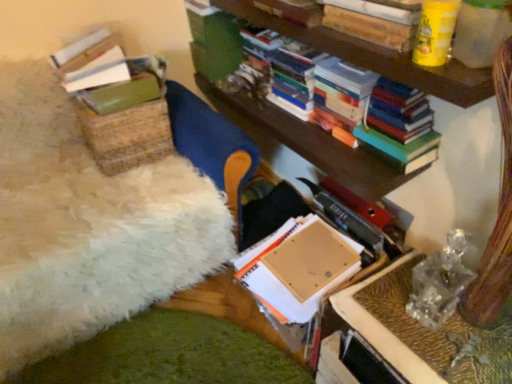
The height and width of the screenshot is (384, 512). In order to click on cardboard box at center, arranged as the second book when viewed from the top in this screenshot , I will do `click(320, 217)`.

Locate an element on the screen. This screenshot has width=512, height=384. hardcover book at upper center, positioned as the 2th book in bottom-to-top order is located at coordinates coord(293,11).

Locate an element on the screen. This screenshot has height=384, width=512. cardboard box at center, arranged as the second book when viewed from the top is located at coordinates tap(320, 217).

Is translucent plastic table at lower right not close to cardboard box at center, arranged as the second book when viewed from the top?

They are positioned close to each other.

Is point (405, 350) closer to camera compared to point (366, 260)?

Yes, point (405, 350) is closer to viewer.

From a real-world perspective, which is physically above, cardboard box at center, arranged as the second book when viewed from the top, or hardcover book at upper center, positioned as the 2th book in bottom-to-top order?

From a 3D spatial view, hardcover book at upper center, positioned as the 2th book in bottom-to-top order, is above.

Image resolution: width=512 pixels, height=384 pixels. In order to click on book above the cardboard box at center, the 1th book from the bottom (from a real-world perspective) in this screenshot , I will do `click(293, 11)`.

From the image's perspective, between cardboard box at center, arranged as the second book when viewed from the top, and hardcover book at upper center, marked as the first book in a top-to-bottom arrangement, who is located below?

From the image's view, cardboard box at center, arranged as the second book when viewed from the top, is below.

Is translucent plastic table at lower right further to camera compared to hardcover books at upper right?

No, it is in front of hardcover books at upper right.

From their relative heights in the image, would you say translucent plastic table at lower right is taller or shorter than hardcover books at upper right?

translucent plastic table at lower right is shorter than hardcover books at upper right.

From the image's perspective, is translucent plastic table at lower right above or below hardcover books at upper right?

Based on their image positions, translucent plastic table at lower right is located beneath hardcover books at upper right.

From a real-world perspective, which is physically above, translucent plastic table at lower right or hardcover books at upper right?

hardcover books at upper right.

The height and width of the screenshot is (384, 512). I want to click on book that is under the hardcover books at upper right (from a real-world perspective), so click(320, 217).

Consider the image. Is hardcover books at upper right inside the boundaries of cardboard box at center, arranged as the second book when viewed from the top, or outside?

hardcover books at upper right is located beyond the bounds of cardboard box at center, arranged as the second book when viewed from the top.

Is hardcover books at upper right directly adjacent to cardboard box at center, the 1th book from the bottom?

hardcover books at upper right and cardboard box at center, the 1th book from the bottom, are not in contact.

Which is behind, point (362, 133) or point (368, 233)?

Point (368, 233)

Considering the relative positions of hardcover books at upper right and hardcover book at upper center, positioned as the 2th book in bottom-to-top order, in the image provided, is hardcover books at upper right to the left of hardcover book at upper center, positioned as the 2th book in bottom-to-top order, from the viewer's perspective?

In fact, hardcover books at upper right is to the right of hardcover book at upper center, positioned as the 2th book in bottom-to-top order.

Between hardcover books at upper right and hardcover book at upper center, marked as the first book in a top-to-bottom arrangement, which one has smaller width?

With smaller width is hardcover books at upper right.

Is hardcover books at upper right facing away from hardcover book at upper center, positioned as the 2th book in bottom-to-top order?

No, hardcover book at upper center, positioned as the 2th book in bottom-to-top order, is not at the back of hardcover books at upper right.

Looking at this image, from a real-world perspective, is hardcover books at upper right above or below hardcover book at upper center, marked as the first book in a top-to-bottom arrangement?

hardcover books at upper right is situated lower than hardcover book at upper center, marked as the first book in a top-to-bottom arrangement, in the real world.

From the picture: Between hardcover books at upper right and translucent plastic table at lower right, which one has more height?

Standing taller between the two is hardcover books at upper right.

Are hardcover books at upper right and translucent plastic table at lower right making contact?

No, hardcover books at upper right is not beside translucent plastic table at lower right.

From a real-world perspective, is hardcover books at upper right above or below translucent plastic table at lower right?

hardcover books at upper right is above translucent plastic table at lower right.

In the image, there is a hardcover book at upper center, positioned as the 2th book in bottom-to-top order. At what (x,y) coordinates should I click in order to perform the action: click on book below it (from the image's perspective). Please return your answer as a coordinate pair (x, y). The height and width of the screenshot is (384, 512). Looking at the image, I should click on (320, 217).

From a real-world perspective, does hardcover book at upper center, marked as the first book in a top-to-bottom arrangement, stand above cardboard box at center, the 1th book from the bottom?

Correct, in the physical world, hardcover book at upper center, marked as the first book in a top-to-bottom arrangement, is higher than cardboard box at center, the 1th book from the bottom.

Is hardcover book at upper center, marked as the first book in a top-to-bottom arrangement, located outside cardboard box at center, the 1th book from the bottom?

That's correct, hardcover book at upper center, marked as the first book in a top-to-bottom arrangement, is outside of cardboard box at center, the 1th book from the bottom.

Is hardcover book at upper center, marked as the first book in a top-to-bottom arrangement, shorter than cardboard box at center, arranged as the second book when viewed from the top?

Indeed, hardcover book at upper center, marked as the first book in a top-to-bottom arrangement, has a lesser height compared to cardboard box at center, arranged as the second book when viewed from the top.

I want to click on table that is below the cardboard box at center, the 1th book from the bottom (from the image's perspective), so click(x=407, y=339).

Image resolution: width=512 pixels, height=384 pixels. I want to click on book above the cardboard box at center, arranged as the second book when viewed from the top (from the image's perspective), so click(293, 11).

In the scene shown: Looking at the image, which one is located further to translucent plastic table at lower right, hardcover book at upper center, positioned as the 2th book in bottom-to-top order, or hardcover books at upper right?

The object further to translucent plastic table at lower right is hardcover book at upper center, positioned as the 2th book in bottom-to-top order.

Considering their positions, is hardcover books at upper right positioned further to hardcover book at upper center, marked as the first book in a top-to-bottom arrangement, than translucent plastic table at lower right?

translucent plastic table at lower right is further to hardcover book at upper center, marked as the first book in a top-to-bottom arrangement.

When comparing their distances from hardcover books at upper right, does hardcover book at upper center, positioned as the 2th book in bottom-to-top order, or translucent plastic table at lower right seem closer?

hardcover book at upper center, positioned as the 2th book in bottom-to-top order.

From the image, which object appears to be farther from hardcover book at upper center, positioned as the 2th book in bottom-to-top order, cardboard box at center, arranged as the second book when viewed from the top, or hardcover books at upper right?

Among the two, cardboard box at center, arranged as the second book when viewed from the top, is located further to hardcover book at upper center, positioned as the 2th book in bottom-to-top order.

From the image, which object appears to be farther from hardcover book at upper center, marked as the first book in a top-to-bottom arrangement, translucent plastic table at lower right or hardcover books at upper right?

translucent plastic table at lower right is positioned further to the anchor hardcover book at upper center, marked as the first book in a top-to-bottom arrangement.

Estimate the real-world distances between objects in this image. Which object is further from cardboard box at center, arranged as the second book when viewed from the top, hardcover book at upper center, marked as the first book in a top-to-bottom arrangement, or hardcover books at upper right?

Based on the image, hardcover book at upper center, marked as the first book in a top-to-bottom arrangement, appears to be further to cardboard box at center, arranged as the second book when viewed from the top.

Which object lies further to the anchor point hardcover books at upper right, cardboard box at center, the 1th book from the bottom, or translucent plastic table at lower right?

translucent plastic table at lower right.

Based on their spatial positions, is hardcover book at upper center, positioned as the 2th book in bottom-to-top order, or cardboard box at center, the 1th book from the bottom, closer to hardcover books at upper right?

hardcover book at upper center, positioned as the 2th book in bottom-to-top order.

This screenshot has width=512, height=384. What are the coordinates of `book between hardcover book at upper center, positioned as the 2th book in bottom-to-top order, and translucent plastic table at lower right from top to bottom` in the screenshot? It's located at (320, 217).

Identify the location of magazine that lies between hardcover book at upper center, positioned as the 2th book in bottom-to-top order, and cardboard box at center, the 1th book from the bottom, from top to bottom. (399, 126).

In order to click on magazine between hardcover book at upper center, marked as the first book in a top-to-bottom arrangement, and translucent plastic table at lower right vertically in this screenshot , I will do `click(399, 126)`.

Image resolution: width=512 pixels, height=384 pixels. I want to click on book between hardcover books at upper right and translucent plastic table at lower right vertically, so click(320, 217).